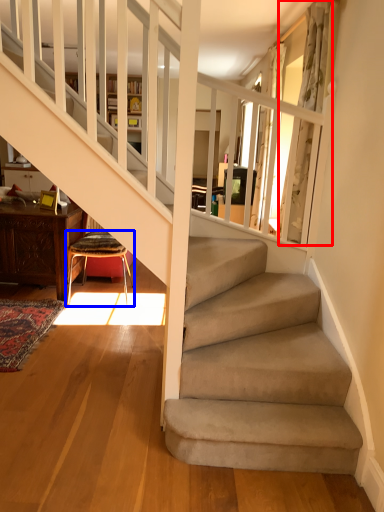
Question: Which object appears farthest to the camera in this image, curtain (highlighted by a red box) or chair (highlighted by a blue box)?

Choices:
 (A) curtain
 (B) chair

Answer: (B)